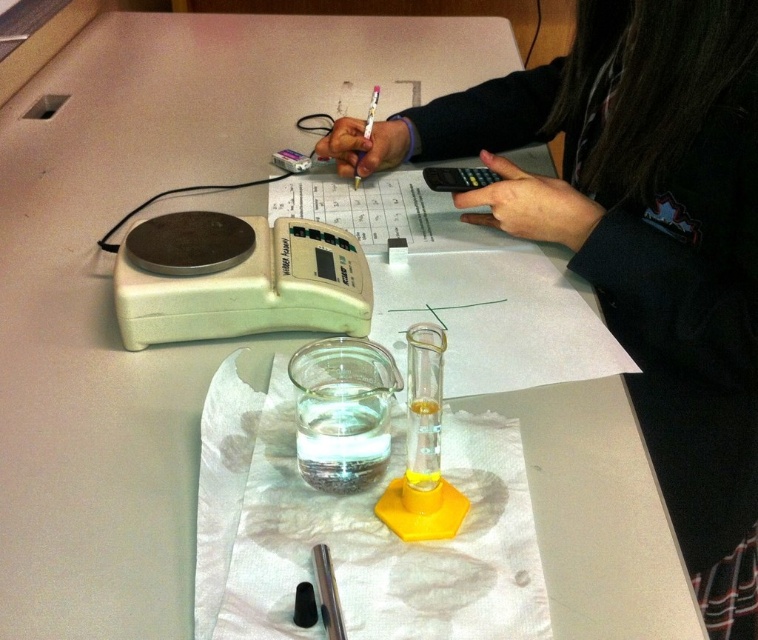
You are a student in a chemistry lab and need to use both the white plastic electronic balance at center and the black plastic calculator at upper center. Which one is positioned higher up on the table?

The black plastic calculator at upper center is positioned higher up on the table than the white plastic electronic balance at center.

You are a researcher in the lab and need to use both the white plastic electronic balance at center and the black plastic calculator at upper center. Which object is closer to you so you can reach it first?

The white plastic electronic balance at center is closer to the viewer than the black plastic calculator at upper center, so you can reach it first.

You need to place a book that requires 3 cm of vertical space between the white plastic electronic balance at center and the black plastic calculator at upper center. Can you fit it there based on their heights?

The white plastic electronic balance at center is taller than the black plastic calculator at upper center. Since the book requires 3 cm of vertical space, and the height difference between the two objects is not specified, it is unclear if there is enough space. Please check the actual height difference to determine.